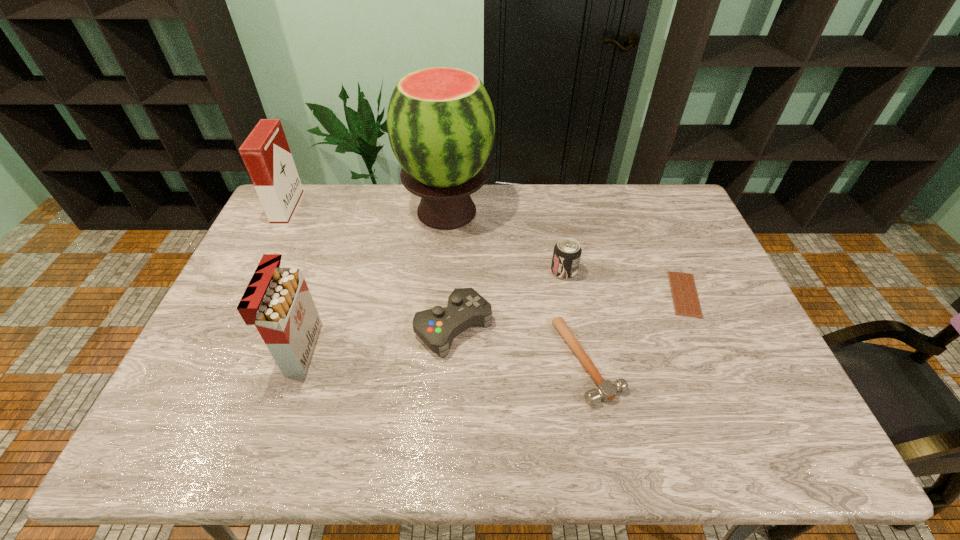
Where is `free space between the leftmost object and the hammer`? free space between the leftmost object and the hammer is located at coordinates (438, 285).

You are a GUI agent. You are given a task and a screenshot of the screen. Output one action in this format:
    pyautogui.click(x=<x>, y=<y>)
    Task: Click on the free area in between the second shortest object and the left cigarette case
    
    Given the screenshot: What is the action you would take?
    pyautogui.click(x=438, y=285)

You are a GUI agent. You are given a task and a screenshot of the screen. Output one action in this format:
    pyautogui.click(x=<x>, y=<y>)
    Task: Click on the empty space that is in between the soda can and the hammer
    Image resolution: width=960 pixels, height=540 pixels.
    Given the screenshot: What is the action you would take?
    pyautogui.click(x=576, y=316)

Locate an element on the screen. The height and width of the screenshot is (540, 960). vacant region between the fifth tallest object and the farther cigarette case is located at coordinates (372, 268).

Identify the location of vacant point located between the rightmost object and the leftmost object. The height and width of the screenshot is (540, 960). (487, 252).

Where is `free area in between the sixth tallest object and the tallest object`? This screenshot has width=960, height=540. free area in between the sixth tallest object and the tallest object is located at coordinates (517, 286).

Identify which object is the closest to the watermelon. Please provide its 2D coordinates. Your answer should be formatted as a tuple, i.e. [(x, y)], where the tuple contains the x and y coordinates of a point satisfying the conditions above.

[(567, 252)]

Identify the location of object that ranks as the second closest to the fourth shortest object. The image size is (960, 540). (441, 126).

What are the coordinates of `vacant region that satisfies the following two spatial constraints: 1. on the front side of the control; 2. with the lid open on the sixth object from right to left` in the screenshot? It's located at (452, 349).

Find the location of `free space that satisfies the following two spatial constraints: 1. on the front-facing side of the left cigarette case; 2. on the left side of the third shortest object`. free space that satisfies the following two spatial constraints: 1. on the front-facing side of the left cigarette case; 2. on the left side of the third shortest object is located at coordinates (230, 327).